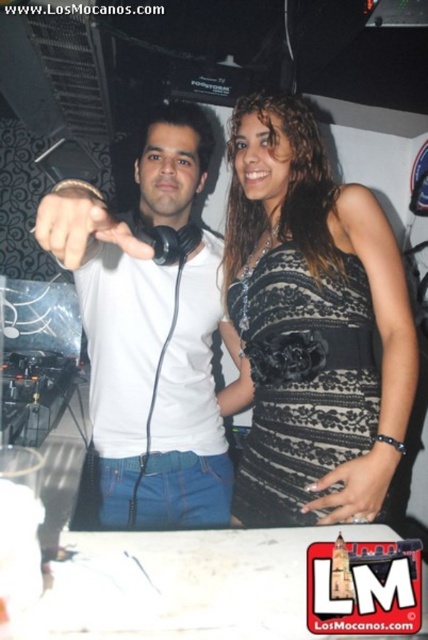
Question: Which object appears farthest from the camera in this image?

Choices:
 (A) black lace dress at center
 (B) white matte t-shirt at center

Answer: (A)

Question: Does black lace dress at center have a smaller size compared to white matte t-shirt at center?

Choices:
 (A) no
 (B) yes

Answer: (B)

Question: Which of the following is the closest to the observer?

Choices:
 (A) white matte t-shirt at center
 (B) black lace dress at center

Answer: (A)

Question: Does black lace dress at center have a larger size compared to white matte t-shirt at center?

Choices:
 (A) yes
 (B) no

Answer: (B)

Question: Can you confirm if black lace dress at center is positioned to the right of white matte t-shirt at center?

Choices:
 (A) yes
 (B) no

Answer: (A)

Question: Which object appears closest to the camera in this image?

Choices:
 (A) black lace dress at center
 (B) white matte t-shirt at center

Answer: (B)